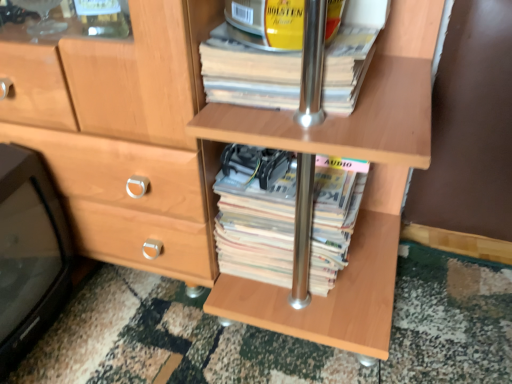
Question: Is black plastic tv at lower left at the back of yellow paper at upper center, placed as the 1th paperback book when sorted from top to bottom?

Choices:
 (A) no
 (B) yes

Answer: (A)

Question: Does yellow paper at upper center, placed as the 1th paperback book when sorted from top to bottom, have a lesser width compared to black plastic tv at lower left?

Choices:
 (A) yes
 (B) no

Answer: (B)

Question: Could you tell me if yellow paper at upper center, placed as the 1th paperback book when sorted from top to bottom, is facing black plastic tv at lower left?

Choices:
 (A) no
 (B) yes

Answer: (A)

Question: From the image's perspective, is yellow paper at upper center, which is the second paperback book from bottom to top, below black plastic tv at lower left?

Choices:
 (A) no
 (B) yes

Answer: (A)

Question: Is yellow paper at upper center, which is the second paperback book from bottom to top, not within black plastic tv at lower left?

Choices:
 (A) yes
 (B) no

Answer: (A)

Question: From a real-world perspective, relative to white paper at center, the second paperback book viewed from the top, is black plastic tv at lower left vertically above or below?

Choices:
 (A) above
 (B) below

Answer: (A)

Question: In terms of height, does black plastic tv at lower left look taller or shorter compared to white paper at center, placed as the 1th paperback book when sorted from bottom to top?

Choices:
 (A) tall
 (B) short

Answer: (A)

Question: Which is correct: black plastic tv at lower left is inside white paper at center, placed as the 1th paperback book when sorted from bottom to top, or outside of it?

Choices:
 (A) inside
 (B) outside

Answer: (B)

Question: Considering their positions, is black plastic tv at lower left located in front of or behind white paper at center, the second paperback book viewed from the top?

Choices:
 (A) front
 (B) behind

Answer: (A)

Question: From the image's perspective, is yellow paper at upper center, placed as the 1th paperback book when sorted from top to bottom, located above or below black plastic tv at lower left?

Choices:
 (A) above
 (B) below

Answer: (A)

Question: Is point (224, 23) positioned closer to the camera than point (17, 155)?

Choices:
 (A) closer
 (B) farther

Answer: (A)

Question: Is yellow paper at upper center, which is the second paperback book from bottom to top, wider or thinner than black plastic tv at lower left?

Choices:
 (A) thin
 (B) wide

Answer: (B)

Question: Considering the positions of yellow paper at upper center, placed as the 1th paperback book when sorted from top to bottom, and black plastic tv at lower left in the image, is yellow paper at upper center, placed as the 1th paperback book when sorted from top to bottom, bigger or smaller than black plastic tv at lower left?

Choices:
 (A) big
 (B) small

Answer: (B)

Question: Is point (243, 231) closer or farther from the camera than point (61, 228)?

Choices:
 (A) farther
 (B) closer

Answer: (B)

Question: From the image's perspective, is white paper at center, placed as the 1th paperback book when sorted from bottom to top, located above or below black plastic tv at lower left?

Choices:
 (A) below
 (B) above

Answer: (B)